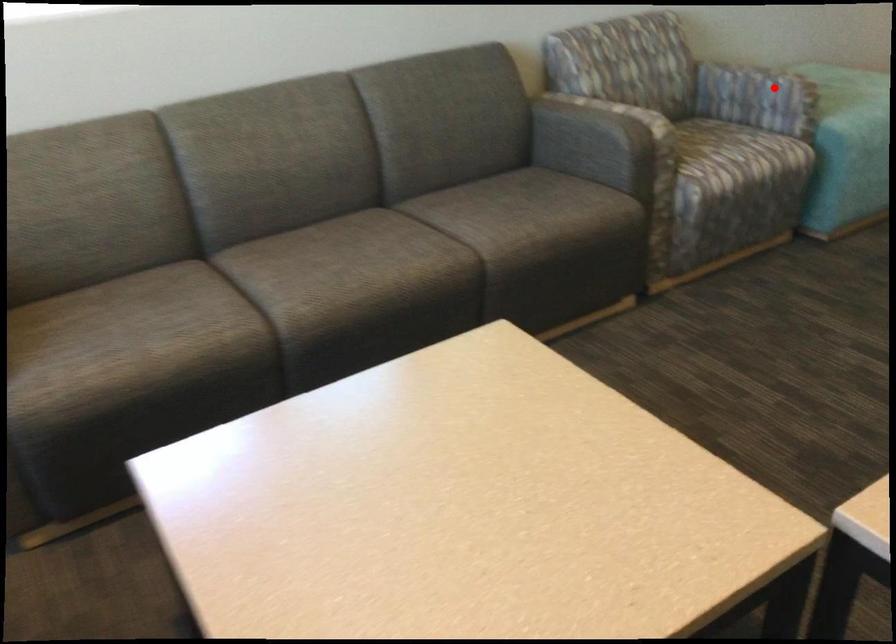
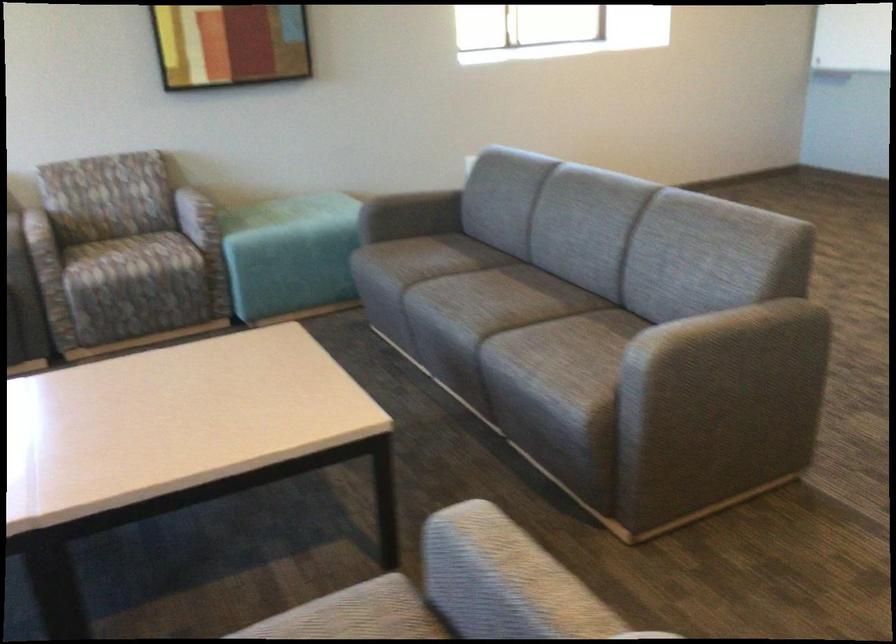
Where in the second image is the point corresponding to the highlighted location from the first image?

(197, 216)